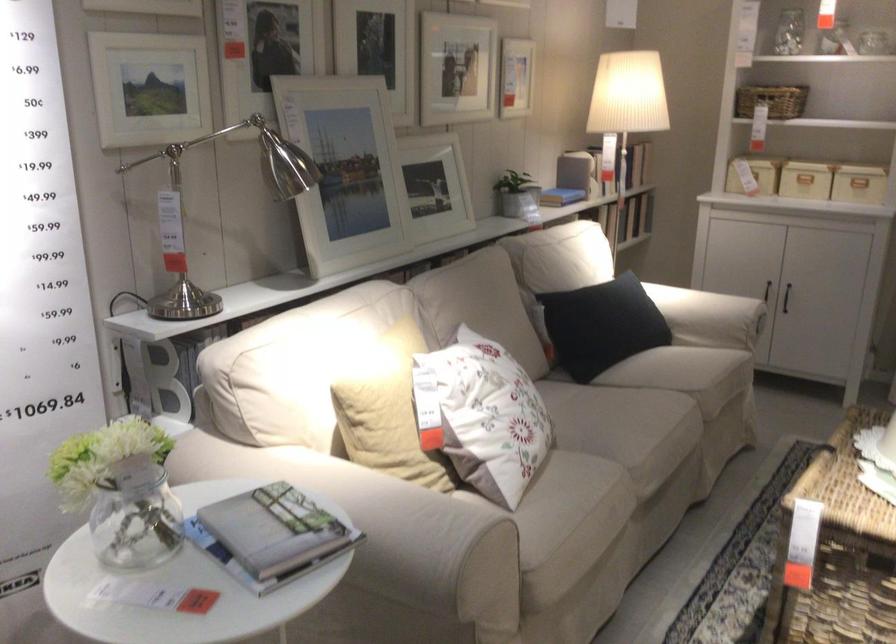
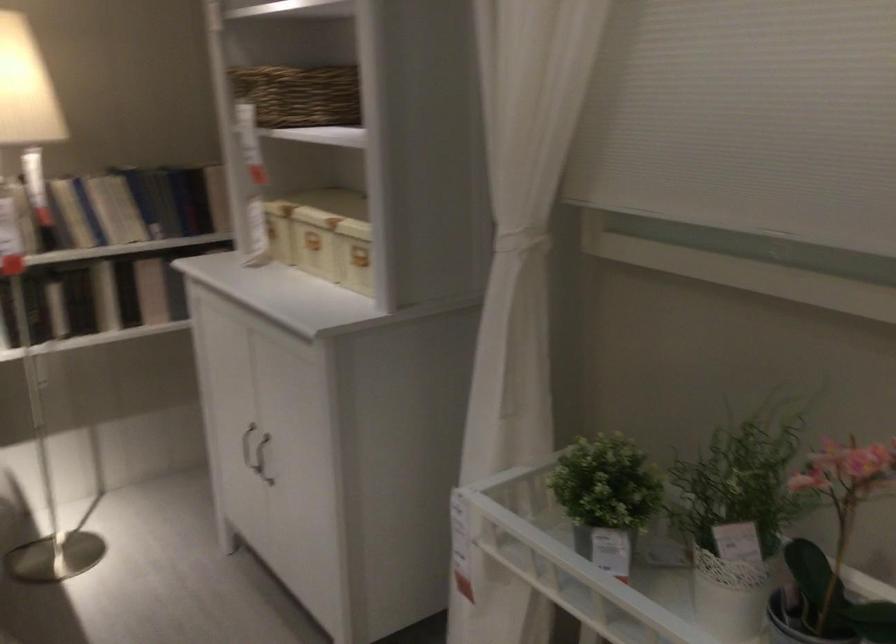
Which direction would the cameraman need to move to produce the second image?

The movement direction of the cameraman is right, forward.